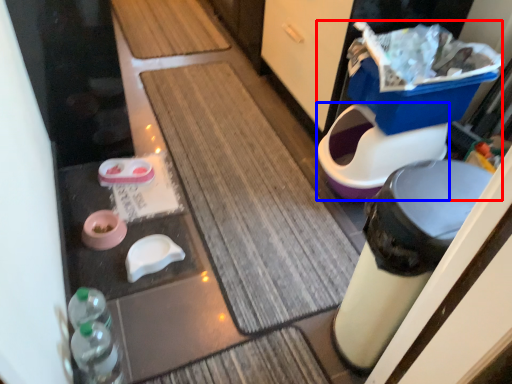
Question: Among these objects, which one is nearest to the camera, potty (highlighted by a red box) or toilet bowl (highlighted by a blue box)?

Choices:
 (A) potty
 (B) toilet bowl

Answer: (A)